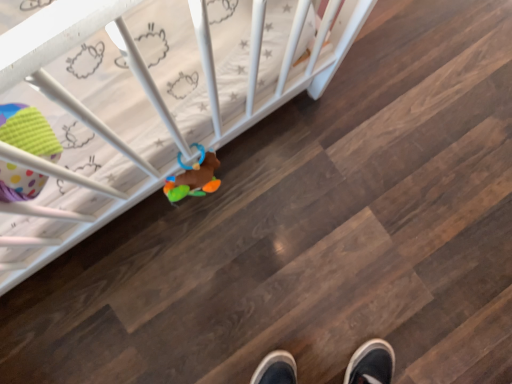
Question: Is multicolored plush toy at center, placed as the 1th toy when sorted from right to left, taller or shorter than polka dot fabric toy at left, which ranks as the 2th toy in right-to-left order?

Choices:
 (A) short
 (B) tall

Answer: (A)

Question: From a real-world perspective, is multicolored plush toy at center, placed as the second toy when sorted from left to right, above or below polka dot fabric toy at left, marked as the first toy in a left-to-right arrangement?

Choices:
 (A) below
 (B) above

Answer: (A)

Question: Which is nearer to the polka dot fabric toy at left, acting as the 2th toy starting from the back?

Choices:
 (A) white plastic crib at upper left
 (B) multicolored plush toy at center, which is the second toy in front-to-back order

Answer: (A)

Question: Estimate the real-world distances between objects in this image. Which object is closer to the polka dot fabric toy at left, marked as the first toy in a left-to-right arrangement?

Choices:
 (A) white plastic crib at upper left
 (B) multicolored plush toy at center, the 1th toy when ordered from back to front

Answer: (A)